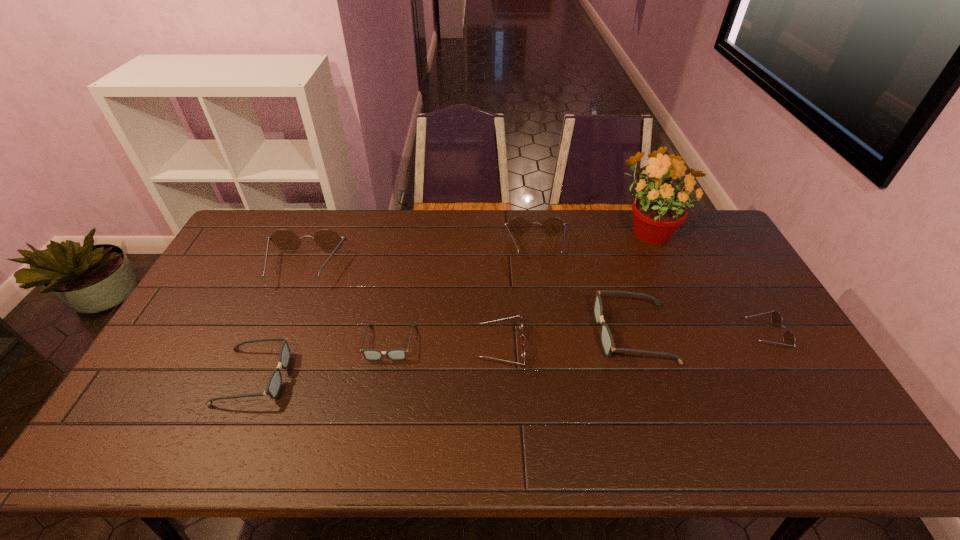
You are a GUI agent. You are given a task and a screenshot of the screen. Output one action in this format:
    pyautogui.click(x=<x>, y=<y>)
    Task: Click on the rightmost object
    This screenshot has height=540, width=960.
    Given the screenshot: What is the action you would take?
    pyautogui.click(x=789, y=339)

Where is `the third object from left to right`? The width and height of the screenshot is (960, 540). the third object from left to right is located at coordinates (369, 354).

Locate an element on the screen. the fifth spectacles from right to left is located at coordinates (369, 354).

This screenshot has width=960, height=540. Identify the location of free space located on the front of the red flowerpot. (680, 304).

This screenshot has width=960, height=540. Find the location of `free space located on the front-facing side of the leftmost yellow spectacles`. free space located on the front-facing side of the leftmost yellow spectacles is located at coordinates (284, 314).

Locate an element on the screen. The width and height of the screenshot is (960, 540). vacant space located 0.400m on the front-facing side of the second biggest yellow spectacles is located at coordinates (553, 361).

Locate an element on the screen. The image size is (960, 540). vacant region located 0.150m on the face of the sixth spectacles from left to right is located at coordinates (544, 333).

The height and width of the screenshot is (540, 960). I want to click on free space located 0.370m on the face of the sixth spectacles from left to right, so (x=468, y=333).

This screenshot has width=960, height=540. I want to click on vacant space located 0.310m on the face of the sixth spectacles from left to right, so click(x=489, y=333).

This screenshot has width=960, height=540. Identify the location of vacant space located 0.300m on the front-facing side of the third biggest yellow spectacles. (372, 348).